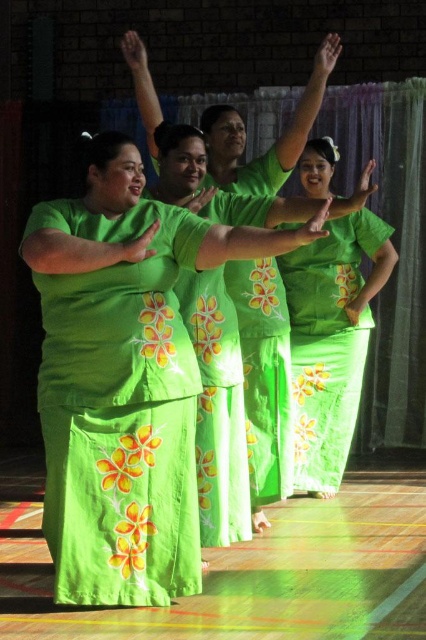
Is point (299, 344) in front of point (103, 266)?

No, (299, 344) is behind (103, 266).

Measure the distance between point (301, 289) and camera.

Point (301, 289) and camera are 22.69 feet apart.

Does point (328, 280) lie in front of point (147, 240)?

No, (328, 280) is further to viewer.

The width and height of the screenshot is (426, 640). Find the location of `green floral skirt at center`. green floral skirt at center is located at coordinates [331, 340].

Which is in front, point (146, 582) or point (218, 417)?

Point (146, 582) is in front.

At what (x,y) coordinates should I click in order to perform the action: click on green floral fabric dress at center. Please return your answer as a coordinate pair (x, y). This screenshot has height=640, width=426. Looking at the image, I should click on (120, 412).

What do you see at coordinates (120, 412) in the screenshot? The width and height of the screenshot is (426, 640). I see `green floral fabric dress at center` at bounding box center [120, 412].

Find the location of a particular element. The width and height of the screenshot is (426, 640). green floral fabric dress at center is located at coordinates pos(120,412).

At what (x,y) coordinates should I click in order to perform the action: click on green floral dress at center. Please return your answer as a coordinate pair (x, y). Looking at the image, I should click on (218, 410).

Where is `green floral dress at center`? green floral dress at center is located at coordinates (218, 410).

Identify the location of green floral dress at center. This screenshot has width=426, height=640. (218, 410).